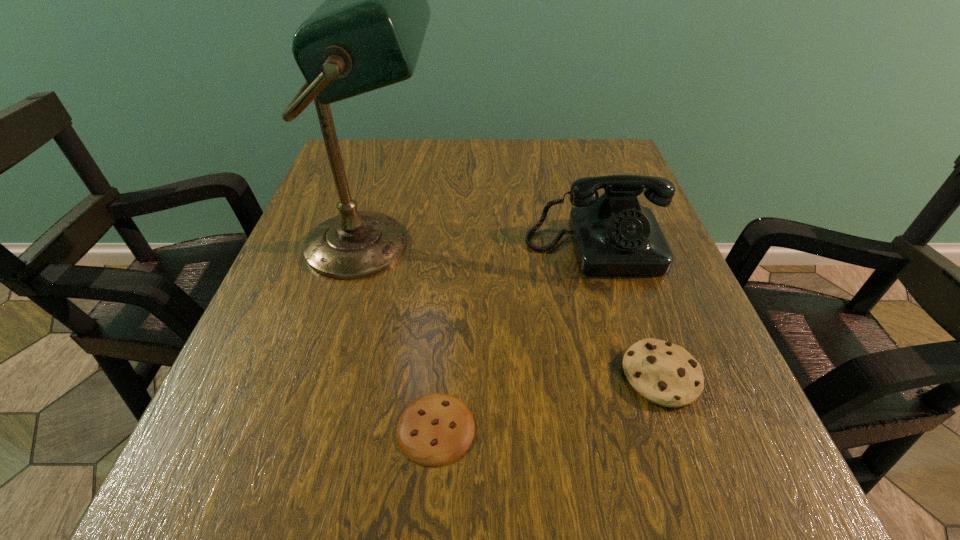
I want to click on object at the near edge, so click(437, 429).

This screenshot has height=540, width=960. I want to click on object present at the left edge, so click(368, 33).

The width and height of the screenshot is (960, 540). Identify the location of telephone present at the right edge. (613, 234).

What are the coordinates of `cookie present at the right edge` in the screenshot? It's located at (664, 373).

What are the coordinates of `free space at the far edge of the desktop` in the screenshot? It's located at (508, 157).

I want to click on free location at the near edge of the desktop, so click(427, 511).

This screenshot has height=540, width=960. I want to click on vacant area at the left edge of the desktop, so click(276, 280).

In the image, there is a desktop. Where is `free space at the right edge`? free space at the right edge is located at coordinates (631, 339).

Identify the location of free space at the far left corner. The image size is (960, 540). (375, 184).

At what (x,y) coordinates should I click in order to perform the action: click on free space at the far right corner. Please return your answer as a coordinate pair (x, y). Looking at the image, I should click on (562, 143).